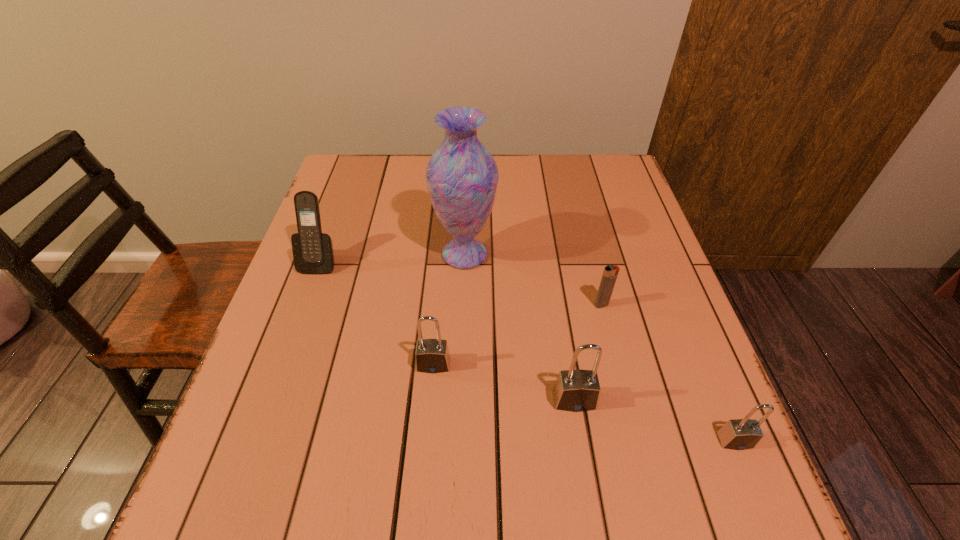
In the image, there is a desktop. Where is `free region at the right edge`? This screenshot has width=960, height=540. free region at the right edge is located at coordinates (627, 229).

Where is `free location at the near left corner`? free location at the near left corner is located at coordinates (311, 445).

Image resolution: width=960 pixels, height=540 pixels. Identify the location of vacant space at the far right corner. (622, 166).

Locate an element on the screen. The width and height of the screenshot is (960, 540). free space between the second farthest padlock and the nearest object is located at coordinates (655, 420).

The height and width of the screenshot is (540, 960). I want to click on free space between the tallest object and the fifth farthest object, so click(x=519, y=327).

Image resolution: width=960 pixels, height=540 pixels. I want to click on unoccupied position between the igniter and the rightmost object, so 668,373.

Where is `empty space between the second farthest padlock and the fourth nearest object`? The width and height of the screenshot is (960, 540). empty space between the second farthest padlock and the fourth nearest object is located at coordinates tap(588, 352).

Where is `empty space between the igniter and the fourth object from left to right`? The width and height of the screenshot is (960, 540). empty space between the igniter and the fourth object from left to right is located at coordinates (588, 352).

Identify the location of free space between the leftmost padlock and the leftmost object. The height and width of the screenshot is (540, 960). (376, 313).

Image resolution: width=960 pixels, height=540 pixels. I want to click on empty location between the fifth object from left to right and the rightmost object, so click(x=668, y=373).